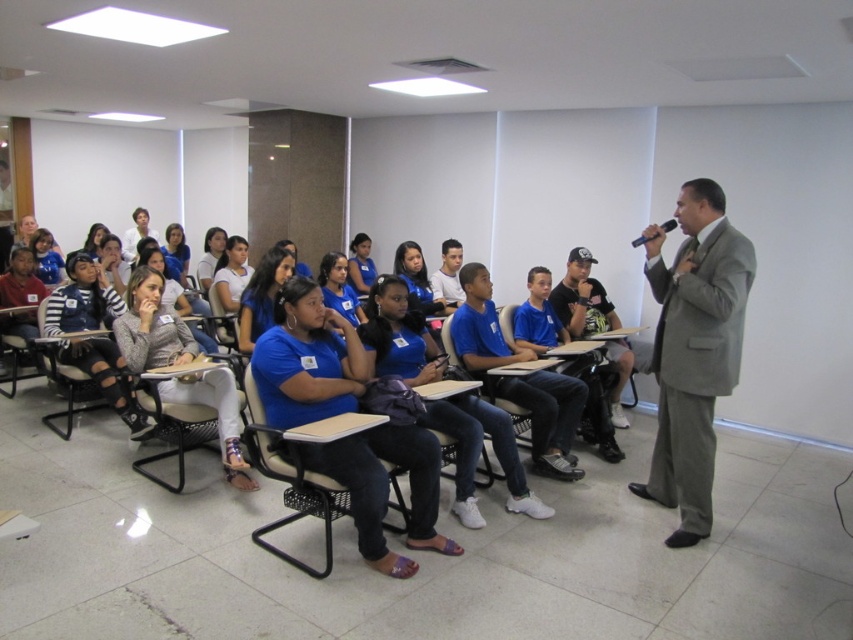
Question: Which point is farther from the camera taking this photo?

Choices:
 (A) (566, 326)
 (B) (15, 368)
 (C) (73, 417)

Answer: (B)

Question: Which point is farther to the camera?

Choices:
 (A) black plastic chair at center
 (B) white shirt at center
 (C) denim fabric chair at lower left

Answer: (B)

Question: Does gray suit at right appear under black plastic chair at center?

Choices:
 (A) no
 (B) yes

Answer: (A)

Question: Does gray suit at right appear under blue cotton shirt at center?

Choices:
 (A) yes
 (B) no

Answer: (A)

Question: Estimate the real-world distances between objects in this image. Which object is farther from the black plastic chair at center?

Choices:
 (A) white shirt at center
 (B) gray suit at right
 (C) denim fabric chair at lower left

Answer: (A)

Question: Does black plastic chair at center have a smaller size compared to white shirt at center?

Choices:
 (A) yes
 (B) no

Answer: (B)